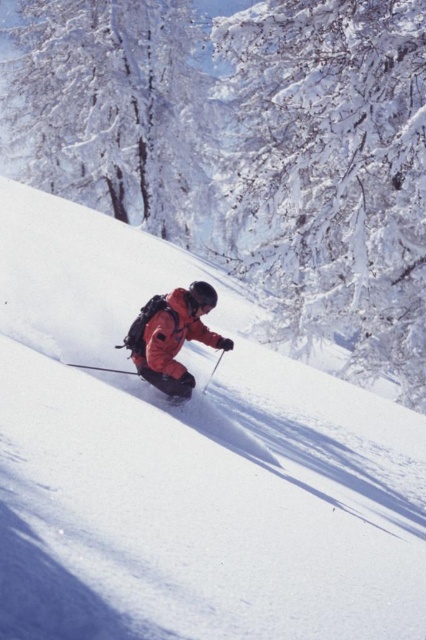
Is snow-covered branches at upper center to the right of metallic silver ski pole at center from the viewer's perspective?

A: Indeed, snow-covered branches at upper center is positioned on the right side of metallic silver ski pole at center.

Who is more distant from viewer, (322,296) or (215,369)?

The point (322,296) is more distant.

The width and height of the screenshot is (426, 640). What do you see at coordinates (337, 170) in the screenshot?
I see `snow-covered branches at upper center` at bounding box center [337, 170].

Locate an element on the screen. The image size is (426, 640). snow-covered branches at upper center is located at coordinates (x=337, y=170).

Is matte orange ski slope at center to the left of white frosty tree at upper left from the viewer's perspective?

Incorrect, matte orange ski slope at center is not on the left side of white frosty tree at upper left.

Is matte orange ski slope at center wider than white frosty tree at upper left?

No, matte orange ski slope at center is not wider than white frosty tree at upper left.

Between point (239, 364) and point (126, 109), which one is positioned in front?

Positioned in front is point (239, 364).

The height and width of the screenshot is (640, 426). Identify the location of matte orange ski slope at center. (186, 461).

Can you confirm if white frosty tree at upper left is bigger than orange softshell jacket at center?

Yes, white frosty tree at upper left is bigger than orange softshell jacket at center.

The height and width of the screenshot is (640, 426). Identify the location of white frosty tree at upper left. (115, 106).